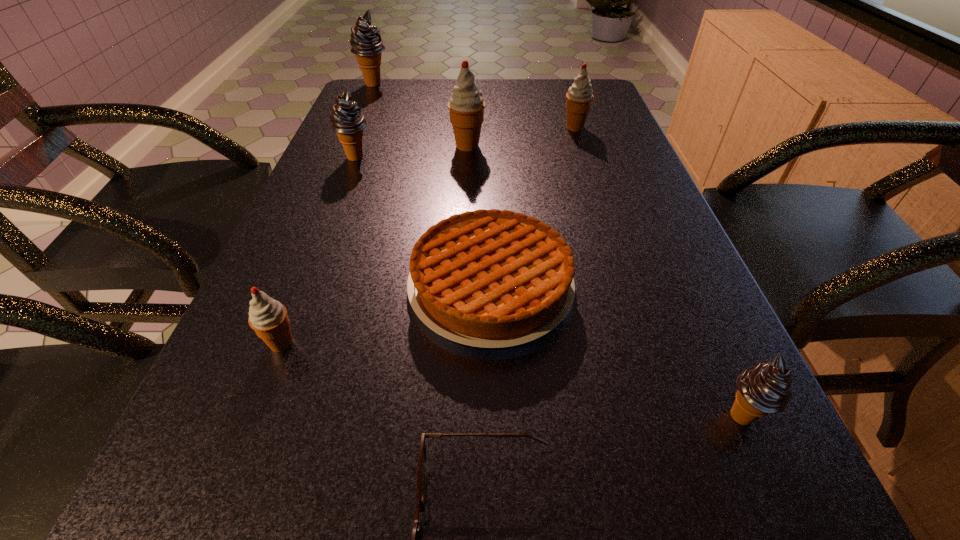
Image resolution: width=960 pixels, height=540 pixels. In order to click on the nearest chocolate icecream in this screenshot , I will do (763, 389).

You are a GUI agent. You are given a task and a screenshot of the screen. Output one action in this format:
    pyautogui.click(x=<x>, y=<y>)
    Task: Click on the pie
    Image resolution: width=960 pixels, height=540 pixels.
    Given the screenshot: What is the action you would take?
    pyautogui.click(x=493, y=278)

Locate an element on the screen. The height and width of the screenshot is (540, 960). free space located on the right of the farthest object is located at coordinates (424, 85).

Locate an element on the screen. Image resolution: width=960 pixels, height=540 pixels. vacant space located 0.370m on the right of the fourth icecream from left to right is located at coordinates (631, 146).

I want to click on vacant space located on the front of the farthest red icecream, so click(x=598, y=200).

Identify the location of free point located 0.150m on the front of the second nearest chocolate icecream. Image resolution: width=960 pixels, height=540 pixels. (339, 203).

The height and width of the screenshot is (540, 960). Identify the location of free space located 0.160m on the right of the second nearest icecream. (401, 343).

The height and width of the screenshot is (540, 960). Find the location of `free space located on the left of the nearest icecream`. free space located on the left of the nearest icecream is located at coordinates (677, 416).

The height and width of the screenshot is (540, 960). I want to click on vacant position located 0.250m on the back of the pie, so click(488, 167).

This screenshot has height=540, width=960. In order to click on object positioned at the far edge in this screenshot , I will do (366, 42).